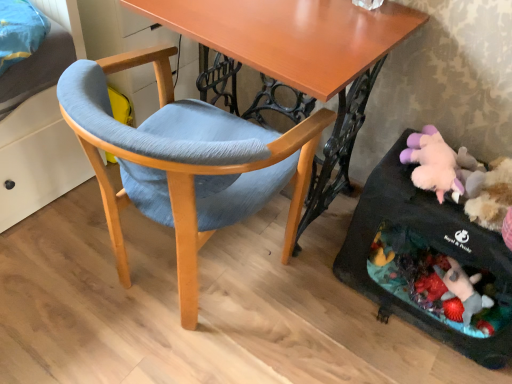
Question: Is black fabric baby carriage at lower right to the left or to the right of wooden desk at center in the image?

Choices:
 (A) left
 (B) right

Answer: (B)

Question: Relative to wooden desk at center, is black fabric baby carriage at lower right in front or behind?

Choices:
 (A) behind
 (B) front

Answer: (A)

Question: Which object is positioned closest to the matte blue fabric chair at center?

Choices:
 (A) wooden desk at center
 (B) black fabric baby carriage at lower right

Answer: (A)

Question: Which of these objects is positioned farthest from the black fabric baby carriage at lower right?

Choices:
 (A) wooden desk at center
 (B) matte blue fabric chair at center

Answer: (B)